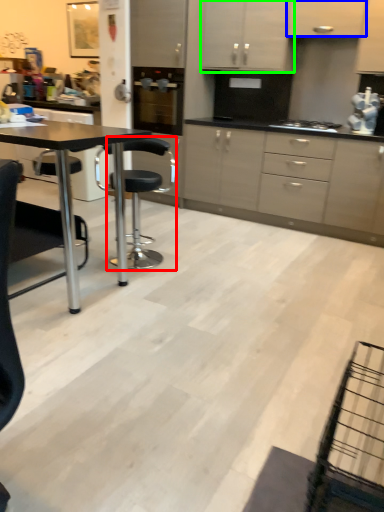
Question: Based on their relative distances, which object is farther from chair (highlighted by a red box)? Choose from cabinetry (highlighted by a blue box) and cabinetry (highlighted by a green box).

Choices:
 (A) cabinetry
 (B) cabinetry

Answer: (A)